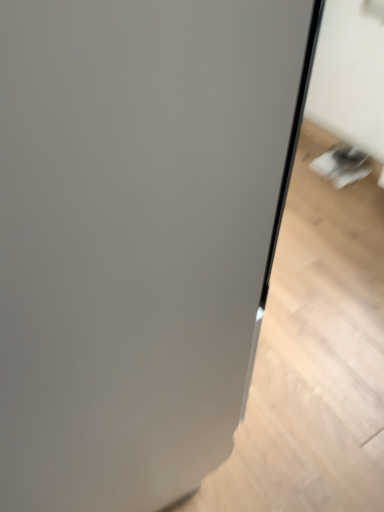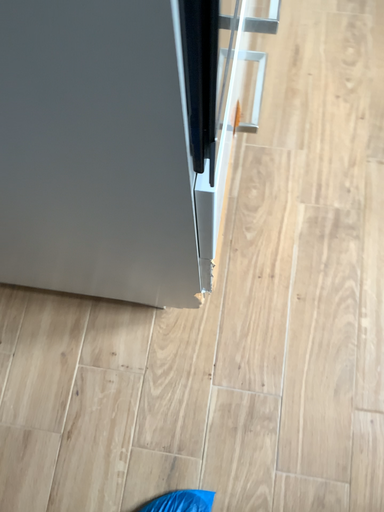
Question: How did the camera likely rotate when shooting the video?

Choices:
 (A) rotated right
 (B) rotated left

Answer: (B)